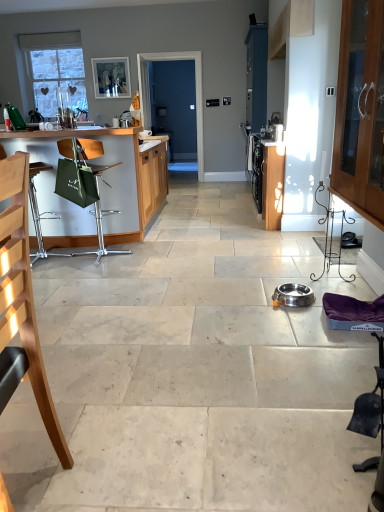
This screenshot has width=384, height=512. Find the location of `free point behind black fabric swivel chair at lower right`. free point behind black fabric swivel chair at lower right is located at coordinates [x=333, y=426].